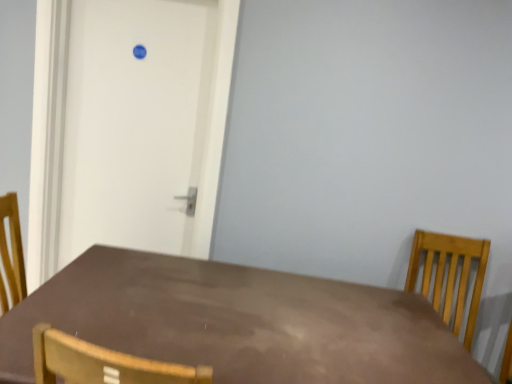
Question: Relative to brown matte table at center, is light brown wooden chair at right in front or behind?

Choices:
 (A) behind
 (B) front

Answer: (A)

Question: Is light brown wooden chair at right bigger or smaller than brown matte table at center?

Choices:
 (A) small
 (B) big

Answer: (A)

Question: Which object is positioned farthest from the light brown wooden chair at right?

Choices:
 (A) white matte door at upper left
 (B) brown matte table at center

Answer: (A)

Question: Estimate the real-world distances between objects in this image. Which object is closer to the light brown wooden chair at right?

Choices:
 (A) white matte door at upper left
 (B) brown matte table at center

Answer: (B)